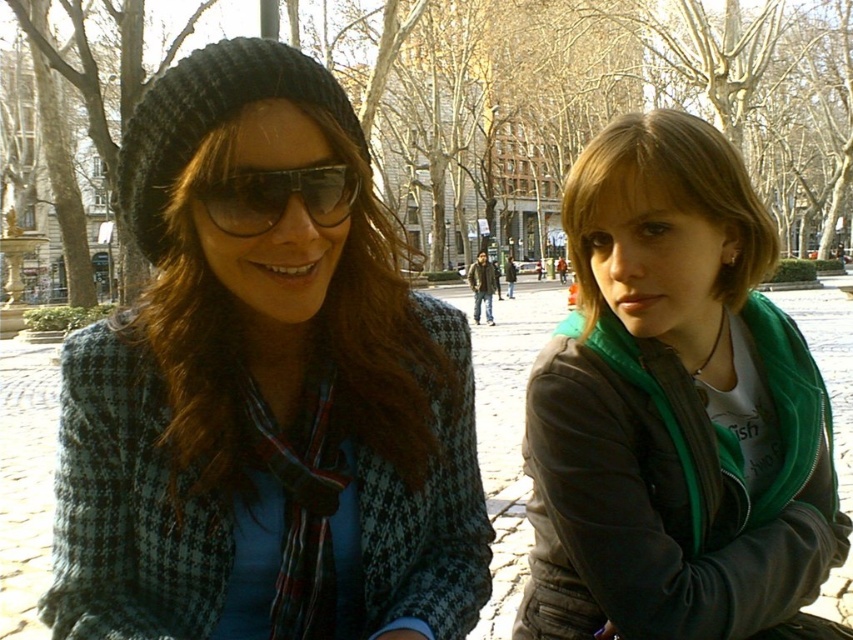
Between green matte scarf at center and black reflective sunglasses at center, which one is positioned lower?

green matte scarf at center is lower down.

Can you confirm if green matte scarf at center is positioned to the left of black reflective sunglasses at center?

In fact, green matte scarf at center is to the right of black reflective sunglasses at center.

Between point (677, 604) and point (328, 200), which one is positioned in front?

Point (328, 200) is in front.

Locate an element on the screen. This screenshot has width=853, height=640. green matte scarf at center is located at coordinates (672, 406).

Find the location of a particular element. This screenshot has height=640, width=853. houndstooth fabric coat at center is located at coordinates (262, 380).

Can you confirm if houndstooth fabric coat at center is positioned below green matte scarf at center?

No, houndstooth fabric coat at center is not below green matte scarf at center.

This screenshot has height=640, width=853. Identify the location of houndstooth fabric coat at center. (262, 380).

Can you confirm if houndstooth fabric coat at center is shorter than black reflective sunglasses at center?

In fact, houndstooth fabric coat at center may be taller than black reflective sunglasses at center.

Which is below, houndstooth fabric coat at center or black reflective sunglasses at center?

Positioned lower is houndstooth fabric coat at center.

Describe the element at coordinates (262, 380) in the screenshot. I see `houndstooth fabric coat at center` at that location.

Find the location of a particular element. The width and height of the screenshot is (853, 640). houndstooth fabric coat at center is located at coordinates (262, 380).